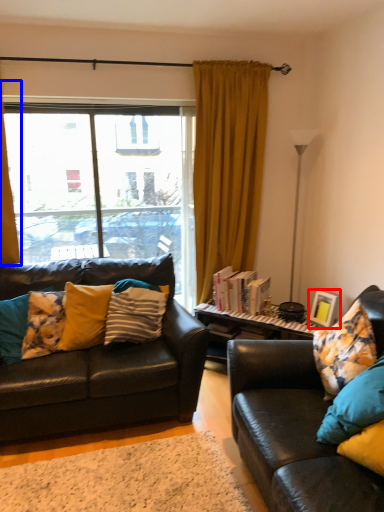
Question: Which object appears farthest to the camera in this image, picture frame (highlighted by a red box) or curtain (highlighted by a blue box)?

Choices:
 (A) picture frame
 (B) curtain

Answer: (A)